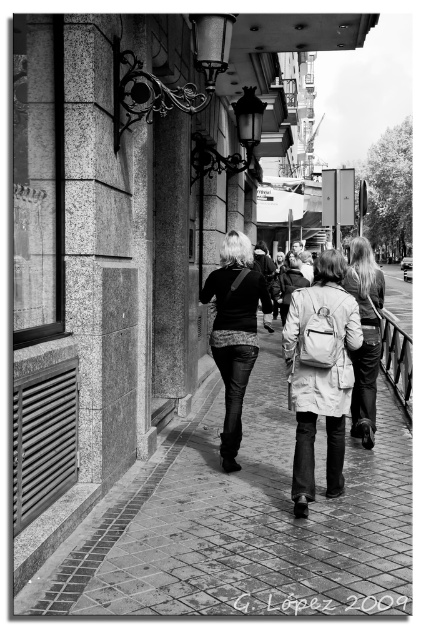
Based on the photo, you are a photographer standing at the camera position. You want to take a photo of two points in the scene. The first point is point (397,404) and the second point is point (362,262). Which point is closer to your camera?

Point (397,404) is closer to the camera than point (362,262) because it is further to the camera than the other point.

You are a photographer standing on the sidewalk in the image. You notice the brick pavement at center and the leather jacket at center. Which object is closer to you?

The brick pavement at center is closer to you because it is in front of the leather jacket at center.

You are a photographer trying to capture the two individuals wearing coats in the scene. Which coat, the light beige coat at center or the matte beige coat at center, is positioned to the left side of the other?

The light beige coat at center is positioned to the left of the matte beige coat at center.